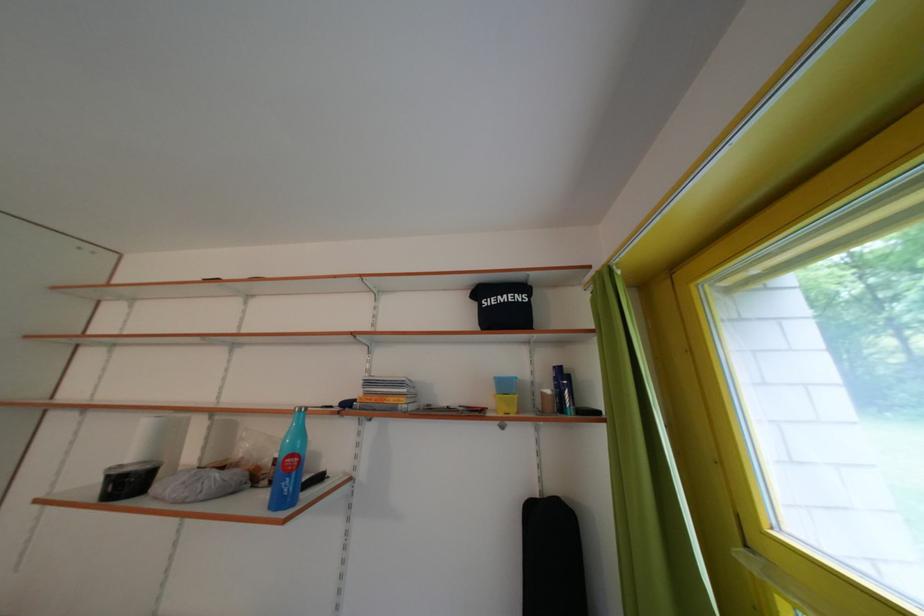
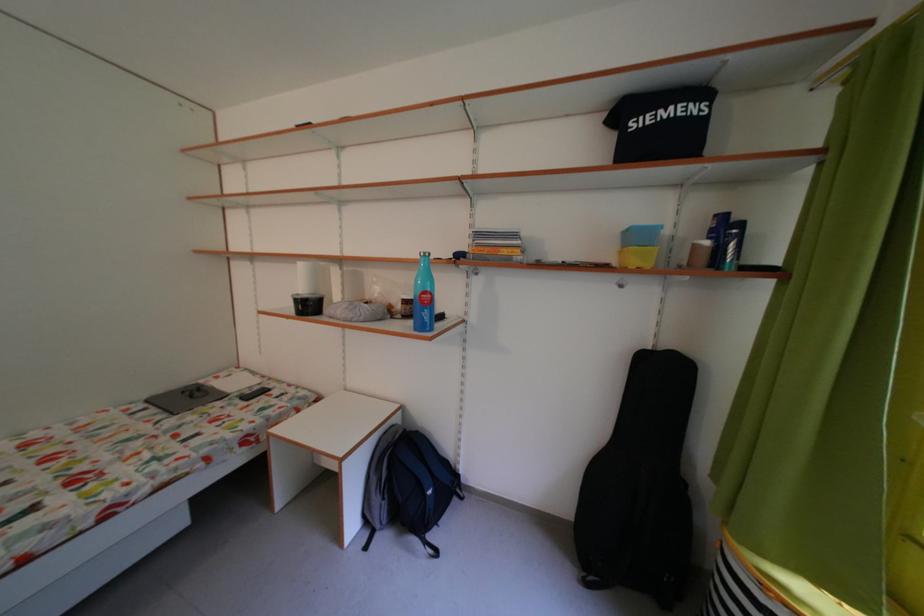
In the second image, find the point that corresponds to pixel 118 483 in the first image.

(306, 306)